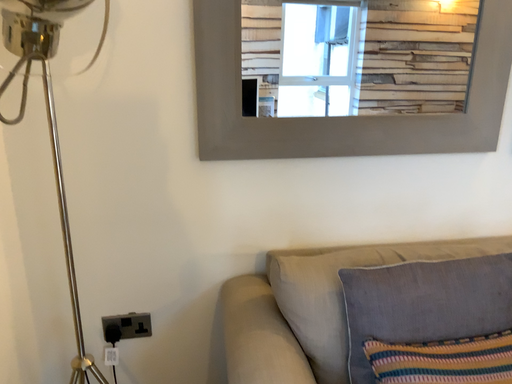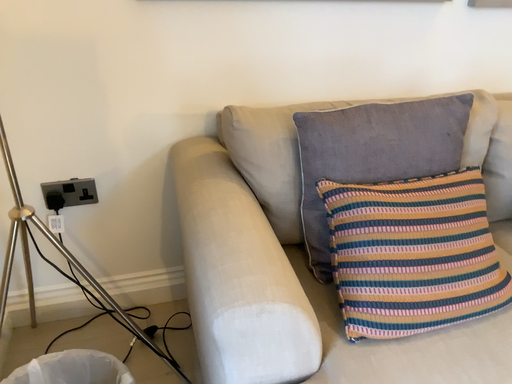
Question: How did the camera likely rotate when shooting the video?

Choices:
 (A) rotated downward
 (B) rotated upward

Answer: (A)